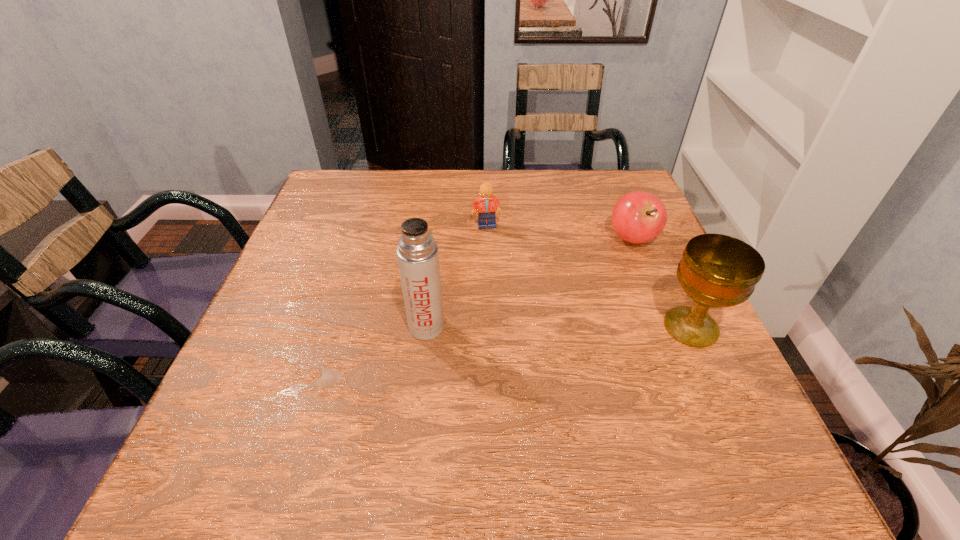
Image resolution: width=960 pixels, height=540 pixels. Identify the location of vacant area between the thermos bottle and the third object from right to left. [x=456, y=276].

Where is `object that is the closest to the second tallest object`? object that is the closest to the second tallest object is located at coordinates (638, 216).

Point out which object is positioned as the third nearest to the leftmost object. Please provide its 2D coordinates. Your answer should be formatted as a tuple, i.e. [(x, y)], where the tuple contains the x and y coordinates of a point satisfying the conditions above.

[(638, 216)]

You are a GUI agent. You are given a task and a screenshot of the screen. Output one action in this format:
    pyautogui.click(x=<x>, y=<y>)
    Task: Click on the vacant space that satisfies the following two spatial constraints: 1. on the front side of the third object from right to left; 2. on the right side of the apple
    The image size is (960, 540).
    Given the screenshot: What is the action you would take?
    pyautogui.click(x=487, y=238)

Find the location of `free region that satisfies the following two spatial constraints: 1. on the front side of the Lego; 2. on the left side of the chalice`. free region that satisfies the following two spatial constraints: 1. on the front side of the Lego; 2. on the left side of the chalice is located at coordinates (489, 328).

Where is `vacant area in the image that satisfies the following two spatial constraints: 1. on the back side of the tallest object; 2. on the right side of the apple`? The width and height of the screenshot is (960, 540). vacant area in the image that satisfies the following two spatial constraints: 1. on the back side of the tallest object; 2. on the right side of the apple is located at coordinates (437, 238).